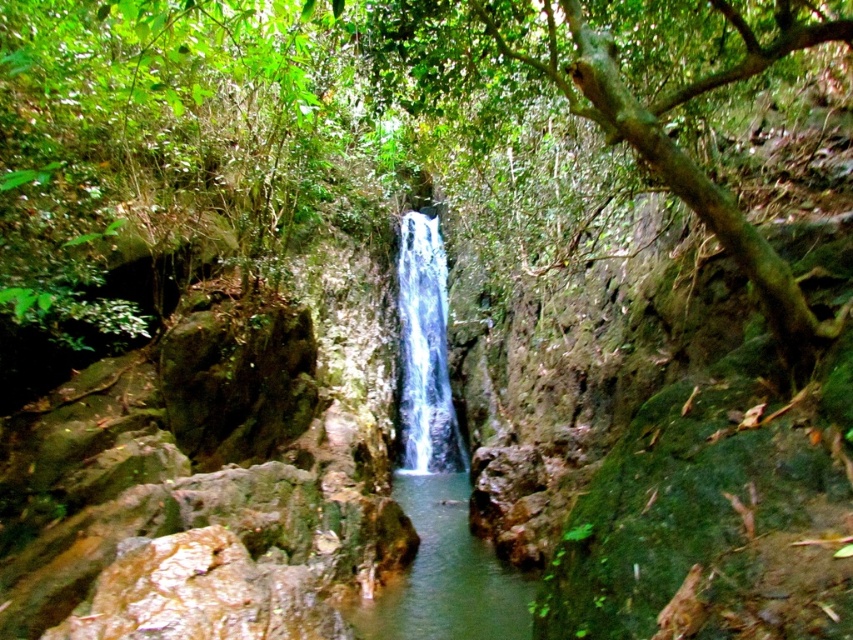
Does point (177, 97) come farther from viewer compared to point (426, 422)?

No, it is in front of (426, 422).

Is green leafy tree at center behind clear water at center?

No.

Describe the element at coordinates (170, 99) in the screenshot. I see `green leafy tree at center` at that location.

This screenshot has width=853, height=640. Find the location of `green leafy tree at center`. green leafy tree at center is located at coordinates (170, 99).